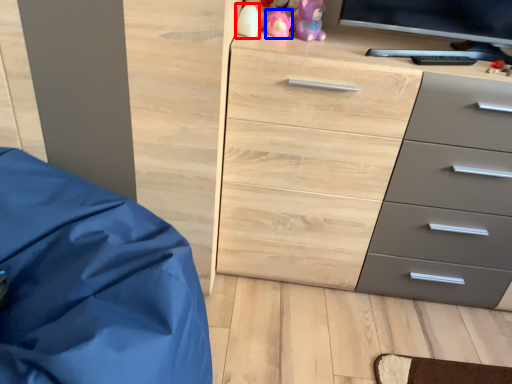
Question: Which object appears closest to the camera in this image, toy (highlighted by a red box) or toy (highlighted by a blue box)?

Choices:
 (A) toy
 (B) toy

Answer: (A)